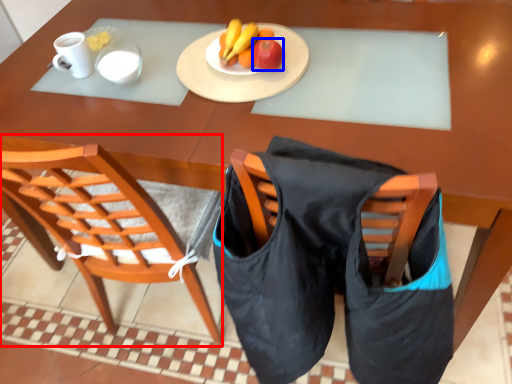
Question: Which object is further to the camera taking this photo, chair (highlighted by a red box) or apple (highlighted by a blue box)?

Choices:
 (A) chair
 (B) apple

Answer: (B)